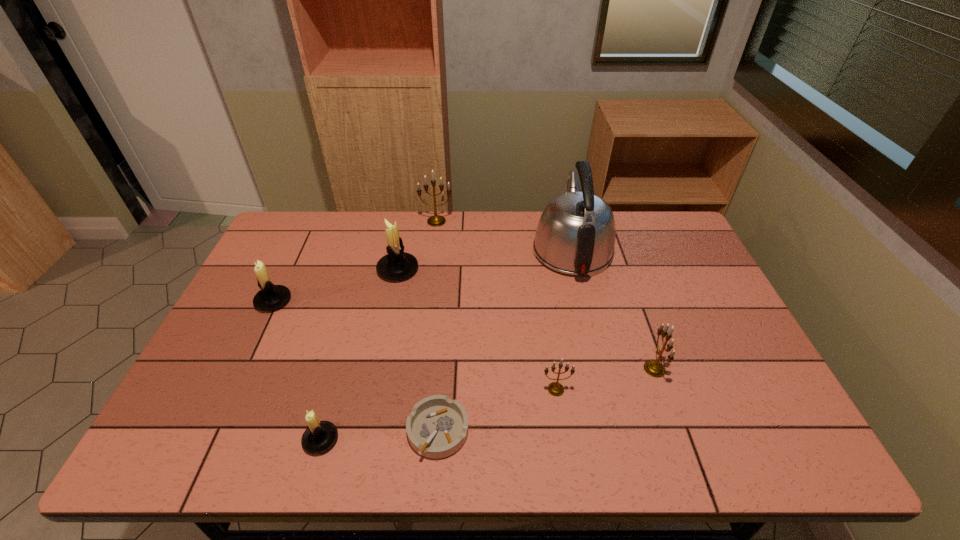
The image size is (960, 540). Identify the location of free spot located on the right of the nearest white candle holder. (512, 440).

The height and width of the screenshot is (540, 960). Identify the location of vacant area situated 0.260m on the back of the ashtray. (446, 321).

I want to click on kettle present at the far edge, so click(x=575, y=235).

This screenshot has width=960, height=540. What are the coordinates of `candelabrum that is at the far edge` in the screenshot? It's located at (436, 220).

This screenshot has height=540, width=960. What are the coordinates of `candle holder that is at the near edge` in the screenshot? It's located at (320, 436).

Locate an element on the screen. ashtray located at the near edge is located at coordinates tap(437, 427).

Where is `object at the left edge`? This screenshot has width=960, height=540. object at the left edge is located at coordinates (270, 297).

Locate an element on the screen. Image resolution: width=960 pixels, height=540 pixels. vacant space at the far edge of the desktop is located at coordinates (437, 246).

This screenshot has height=540, width=960. Identify the location of vacant space at the near edge. (280, 452).

At what (x,y) coordinates should I click in order to perform the action: click on vacant space at the left edge of the desktop. Please return your answer as a coordinate pair (x, y). This screenshot has height=540, width=960. Looking at the image, I should click on (226, 359).